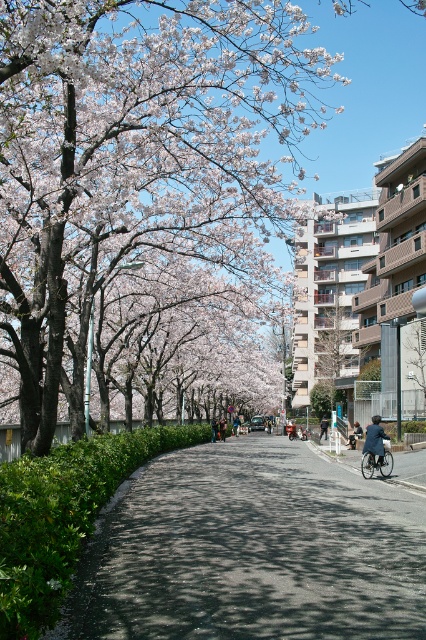
You are a photographer standing on the sidewalk of the cherry blossom lined street. You want to take a photo that includes both the dark blue jeans at center and the denim jacket at center. Which object should you position closer to the camera to ensure both are visible in the frame?

To ensure both the dark blue jeans at center and the denim jacket at center are visible in the frame, you should position the dark blue jeans at center closer to the camera since it is in front of the denim jacket at center.

From the picture: You are a photographer standing on the sidewalk and want to take a photo of the smooth pink blossoms at center and the green leafy hedge at lower left. Which object will appear closer to the camera in the photo?

The smooth pink blossoms at center will appear closer to the camera in the photo because the green leafy hedge at lower left is behind them.

You are standing at the point marked by the coordinates point (324, 426) in the image. What object is located at that point?

The dark blue jacket at center is located at point 0.661, 0.761.